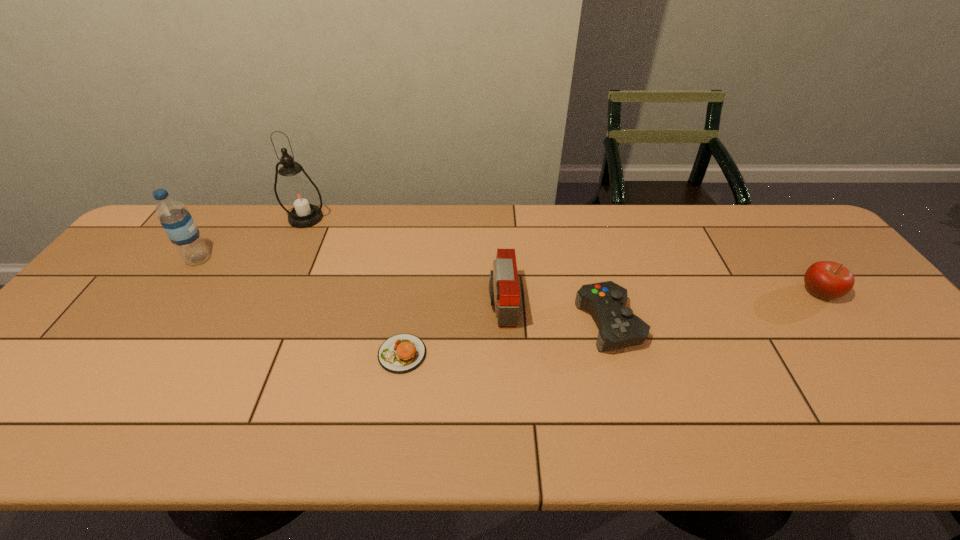
Identify the location of unoccupied position between the third tallest object and the fourth tallest object. (660, 298).

At what (x,y) coordinates should I click in order to perform the action: click on empty space that is in between the fourth object from left to right and the leftmost object. Please return your answer as a coordinate pair (x, y). This screenshot has height=540, width=960. Looking at the image, I should click on (350, 281).

Locate an element on the screen. vacant region between the third tallest object and the patty is located at coordinates (452, 328).

Locate an element on the screen. The height and width of the screenshot is (540, 960). free space between the camera and the leftmost object is located at coordinates (350, 281).

I want to click on blank region between the second object from left to right and the fourth tallest object, so [563, 255].

This screenshot has width=960, height=540. Find the location of `unoccupied area between the rightmost object and the fifth object from right to left`. unoccupied area between the rightmost object and the fifth object from right to left is located at coordinates (563, 255).

The image size is (960, 540). I want to click on free space between the tallest object and the third object from right to left, so click(x=404, y=260).

You are a GUI agent. You are given a task and a screenshot of the screen. Output one action in this format:
    pyautogui.click(x=<x>, y=<y>)
    Task: Click on the vacant region between the fifth nearest object and the fifth object from left to right
    This screenshot has height=540, width=960.
    Given the screenshot: What is the action you would take?
    pyautogui.click(x=404, y=291)

The width and height of the screenshot is (960, 540). I want to click on unoccupied area between the fifth shortest object and the control, so click(x=404, y=291).

The image size is (960, 540). I want to click on empty space that is in between the third object from right to left and the second object from right to left, so click(556, 313).